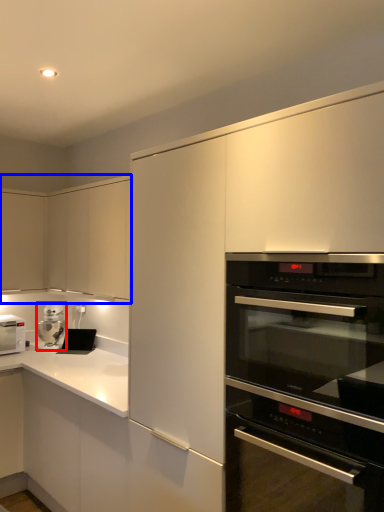
Question: Which object is closer to the camera taking this photo, kitchen appliance (highlighted by a red box) or cabinetry (highlighted by a blue box)?

Choices:
 (A) kitchen appliance
 (B) cabinetry

Answer: (B)